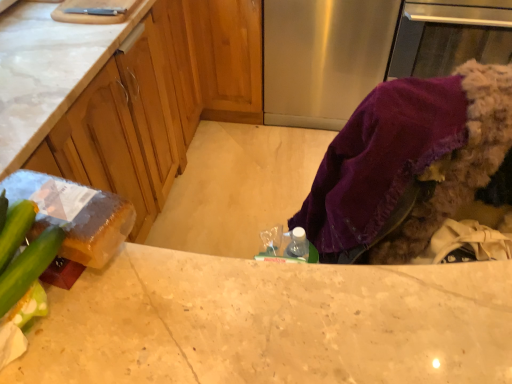
Question: Does point (438, 135) appear closer or farther from the camera than point (84, 377)?

Choices:
 (A) closer
 (B) farther

Answer: (B)

Question: Choose the correct answer: Is purple fabric at lower right inside marble countertop at center or outside it?

Choices:
 (A) outside
 (B) inside

Answer: (A)

Question: Which is nearer to the marble countertop at center?

Choices:
 (A) green matte cucumber at lower left
 (B) matte wood cabinets at center
 (C) purple fabric at lower right
 (D) stainless steel refrigerator at center

Answer: (A)

Question: Estimate the real-world distances between objects in this image. Which object is farther from the stainless steel refrigerator at center?

Choices:
 (A) green matte cucumber at lower left
 (B) purple fabric at lower right
 (C) marble countertop at center
 (D) matte wood cabinets at center

Answer: (A)